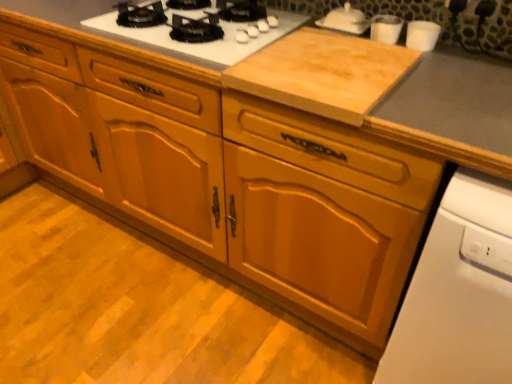
Question: Is natural wood cutting board at center smaller than white glossy dishwasher at lower right?

Choices:
 (A) yes
 (B) no

Answer: (A)

Question: Is natural wood cutting board at center closer to camera compared to white glossy dishwasher at lower right?

Choices:
 (A) yes
 (B) no

Answer: (B)

Question: From a real-world perspective, does natural wood cutting board at center stand above white glossy dishwasher at lower right?

Choices:
 (A) no
 (B) yes

Answer: (B)

Question: Considering the relative positions of natural wood cutting board at center and white glossy dishwasher at lower right in the image provided, is natural wood cutting board at center to the left of white glossy dishwasher at lower right from the viewer's perspective?

Choices:
 (A) yes
 (B) no

Answer: (A)

Question: Is natural wood cutting board at center wider than white glossy dishwasher at lower right?

Choices:
 (A) no
 (B) yes

Answer: (A)

Question: Can you confirm if natural wood cutting board at center is taller than white glossy dishwasher at lower right?

Choices:
 (A) yes
 (B) no

Answer: (B)

Question: From the image's perspective, is clear glass cups at upper right, arranged as the 2th appliance when viewed from the left, beneath white glossy teapot at upper right, which is the 1th appliance in left-to-right order?

Choices:
 (A) no
 (B) yes

Answer: (B)

Question: From the image's perspective, is clear glass cups at upper right, arranged as the 2th appliance when viewed from the left, above white glossy teapot at upper right, which is the 1th appliance in left-to-right order?

Choices:
 (A) yes
 (B) no

Answer: (B)

Question: Is white glossy teapot at upper right, which is the 1th appliance in left-to-right order, at the back of clear glass cups at upper right, the 2th appliance viewed from the right?

Choices:
 (A) no
 (B) yes

Answer: (A)

Question: From a real-world perspective, is clear glass cups at upper right, the 2th appliance viewed from the right, below white glossy teapot at upper right, which is the 1th appliance in left-to-right order?

Choices:
 (A) yes
 (B) no

Answer: (A)

Question: Considering the relative sizes of clear glass cups at upper right, arranged as the 2th appliance when viewed from the left, and white glossy teapot at upper right, which is the 1th appliance in left-to-right order, in the image provided, is clear glass cups at upper right, arranged as the 2th appliance when viewed from the left, taller than white glossy teapot at upper right, which is the 1th appliance in left-to-right order,?

Choices:
 (A) no
 (B) yes

Answer: (A)

Question: From a real-world perspective, does clear glass cups at upper right, the 2th appliance viewed from the right, stand above white glossy teapot at upper right, which is the 1th appliance in left-to-right order?

Choices:
 (A) yes
 (B) no

Answer: (B)

Question: Considering the relative sizes of natural wood cutting board at center and white glossy gas stove at upper center in the image provided, is natural wood cutting board at center bigger than white glossy gas stove at upper center?

Choices:
 (A) no
 (B) yes

Answer: (A)